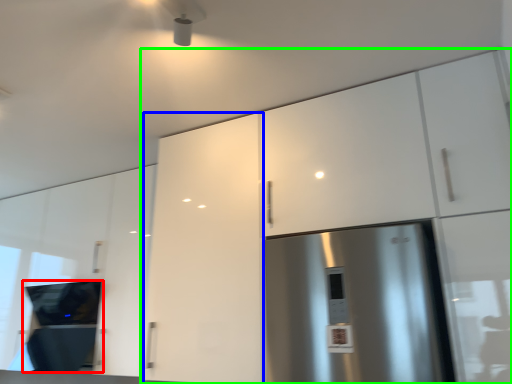
Question: Considering the real-world distances, which object is farthest from appliance (highlighted by a red box)? cabinetry (highlighted by a blue box) or cabinetry (highlighted by a green box)?

Choices:
 (A) cabinetry
 (B) cabinetry

Answer: (B)